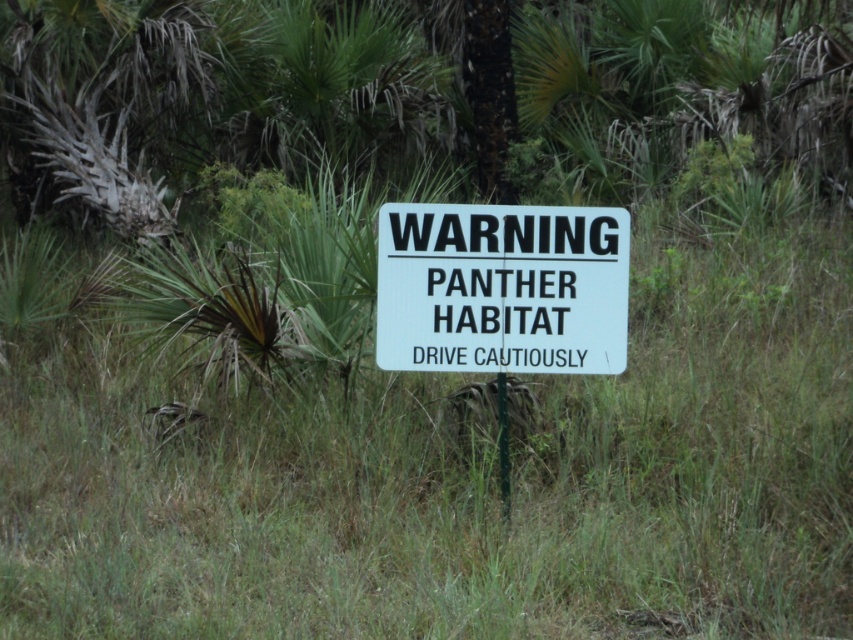
You are driving through a forest area and see the white plastic sign at center and the green leafy tree at center. Which object is wider from your perspective?

The white plastic sign at center is wider than the green leafy tree at center.

You are driving a car and see the green leafy tree at center and the white plastic sign at center ahead. Which object is positioned to the left from your perspective?

The green leafy tree at center is positioned to the left of the white plastic sign at center.